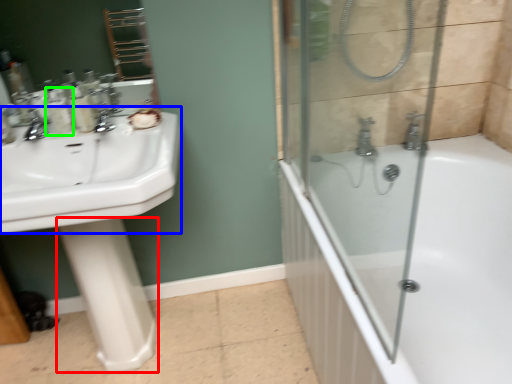
Question: Considering the real-world distances, which object is farthest from bidet (highlighted by a red box)? counter top (highlighted by a blue box) or toiletry (highlighted by a green box)?

Choices:
 (A) counter top
 (B) toiletry

Answer: (B)